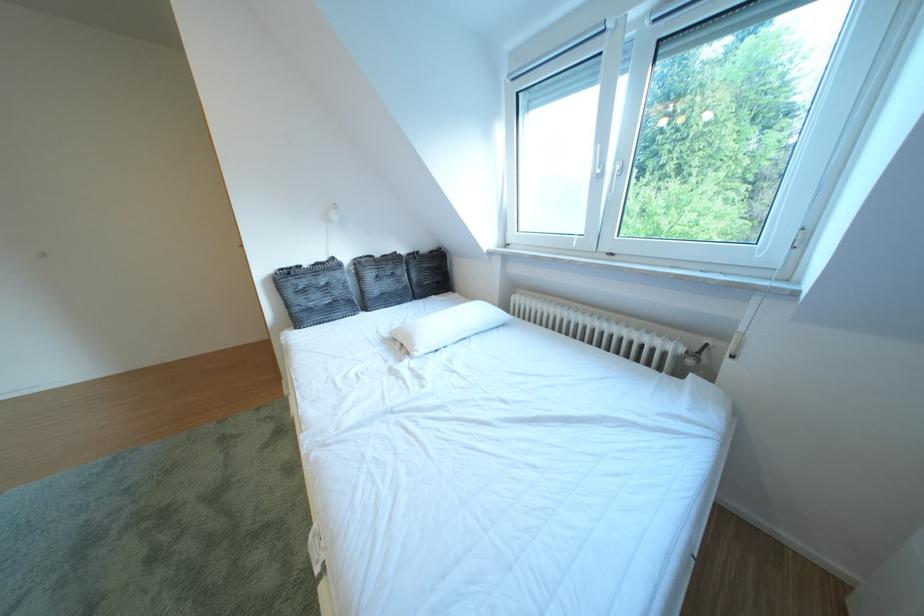
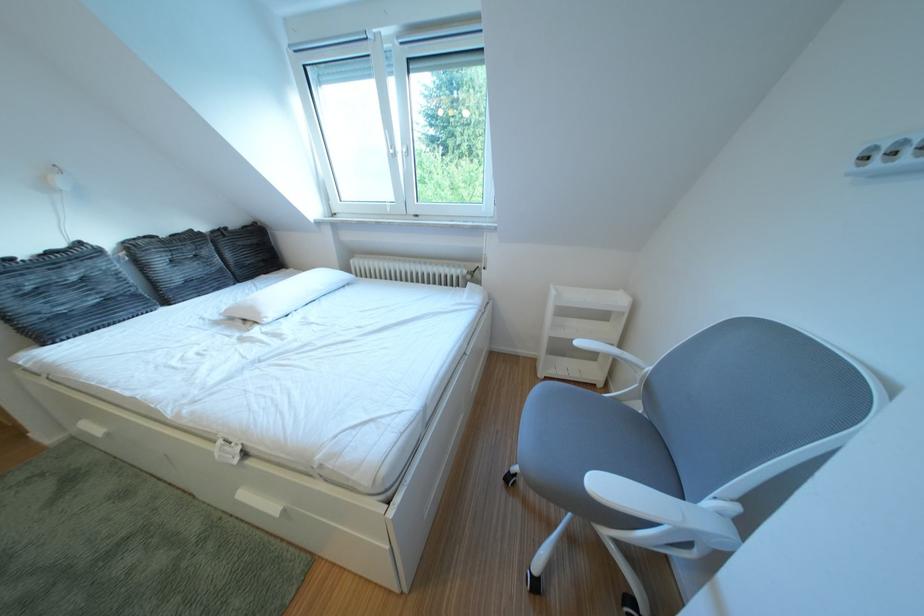
Find the pixel in the second image that matches [391,261] in the first image.

(176, 240)